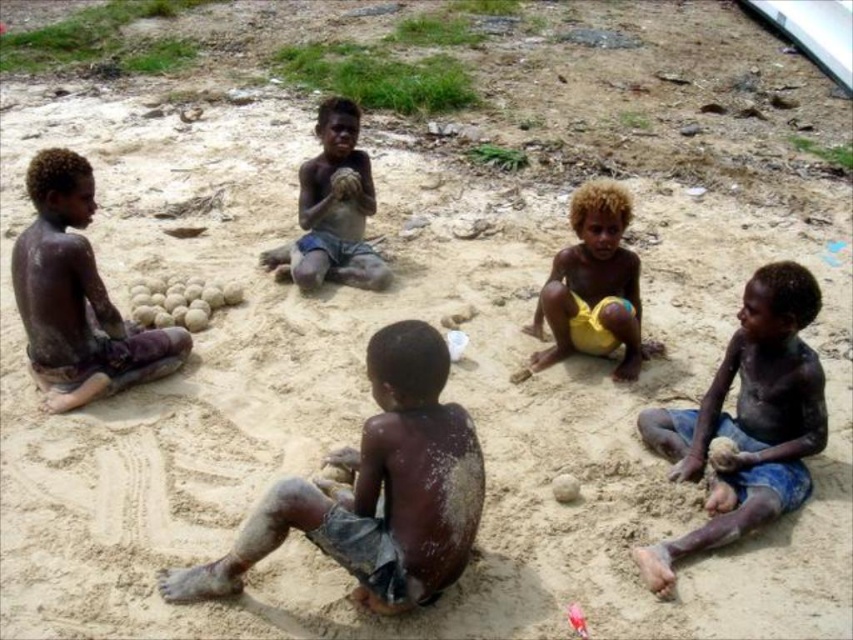
Is dark skin boy at lower right thinner than yellow fabric shorts at center?

No, dark skin boy at lower right is not thinner than yellow fabric shorts at center.

Can you confirm if dark skin boy at lower right is positioned to the left of yellow fabric shorts at center?

In fact, dark skin boy at lower right is to the right of yellow fabric shorts at center.

Identify the location of dark skin boy at lower right. (747, 420).

Find the location of a particular element. The width and height of the screenshot is (853, 640). dark skin boy at lower right is located at coordinates (747, 420).

Does yellow fabric shorts at center have a greater width compared to brown skin/rough skin child at center?

Incorrect, yellow fabric shorts at center's width does not surpass brown skin/rough skin child at center's.

Is yellow fabric shorts at center to the left of brown skin/rough skin child at center from the viewer's perspective?

No, yellow fabric shorts at center is not to the left of brown skin/rough skin child at center.

Who is more forward, [598,276] or [364,272]?

Point [598,276]

This screenshot has height=640, width=853. Find the location of `yellow fabric shorts at center`. yellow fabric shorts at center is located at coordinates (593, 285).

Between dark skin boy at lower right and dark skin boy at left, which one appears on the left side from the viewer's perspective?

Positioned to the left is dark skin boy at left.

Between dark skin boy at lower right and dark skin boy at left, which one is positioned higher?

Positioned higher is dark skin boy at left.

Locate an element on the screen. dark skin boy at lower right is located at coordinates (747, 420).